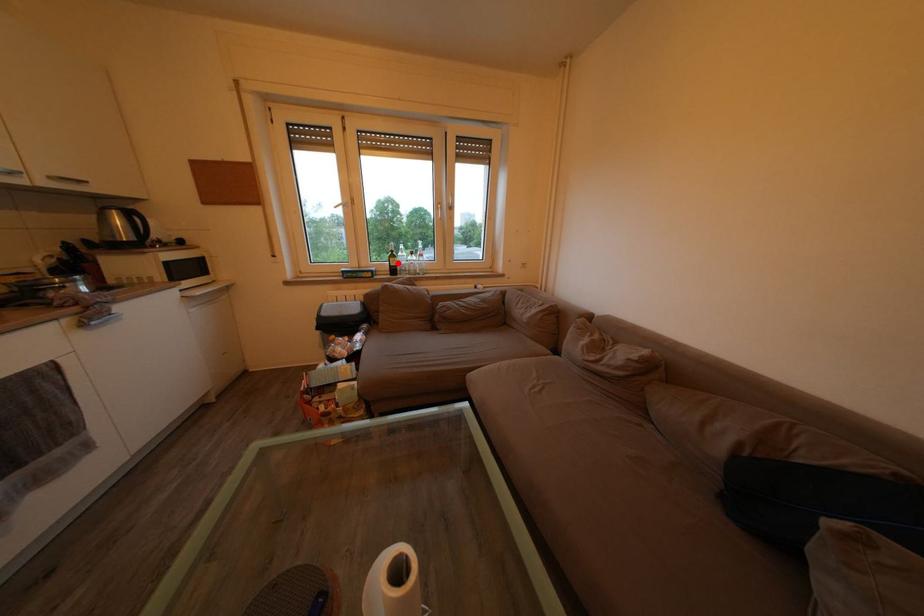
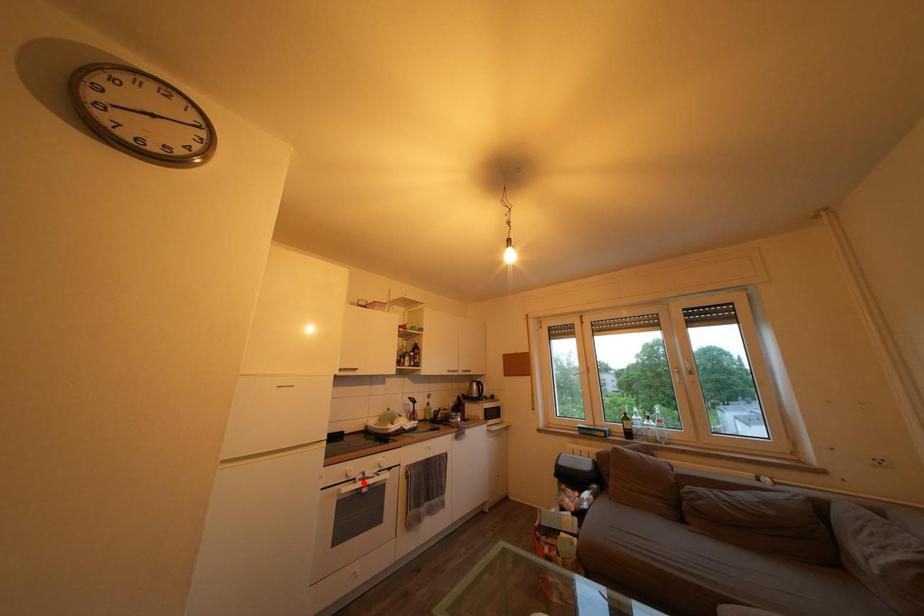
I am providing you with two images of the same scene from different viewpoints. A red point is marked on the first image and another point is marked on the second image. Does the point marked in image1 correspond to the same location as the one in image2?

No